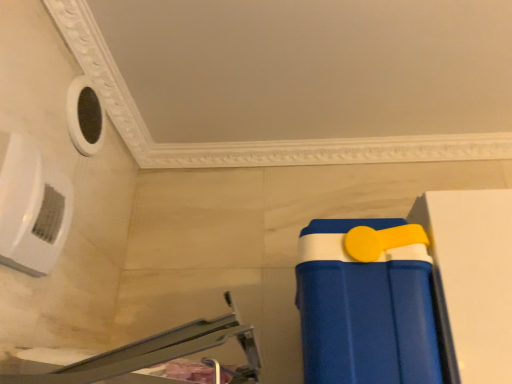
Question: From the image's perspective, is blue plastic tray at lower right above or below blue plastic cooler at lower right?

Choices:
 (A) below
 (B) above

Answer: (B)

Question: Considering the positions of point (238, 329) and point (357, 271), is point (238, 329) closer or farther from the camera than point (357, 271)?

Choices:
 (A) closer
 (B) farther

Answer: (A)

Question: Is blue plastic tray at lower right wider or thinner than blue plastic cooler at lower right?

Choices:
 (A) thin
 (B) wide

Answer: (B)

Question: From the image's perspective, is blue plastic cooler at lower right positioned above or below blue plastic tray at lower right?

Choices:
 (A) below
 (B) above

Answer: (A)

Question: Looking at their shapes, would you say blue plastic cooler at lower right is wider or thinner than blue plastic tray at lower right?

Choices:
 (A) wide
 (B) thin

Answer: (B)

Question: Would you say blue plastic cooler at lower right is to the left or to the right of blue plastic tray at lower right in the picture?

Choices:
 (A) left
 (B) right

Answer: (B)

Question: Is blue plastic cooler at lower right in front of or behind blue plastic tray at lower right in the image?

Choices:
 (A) behind
 (B) front

Answer: (A)